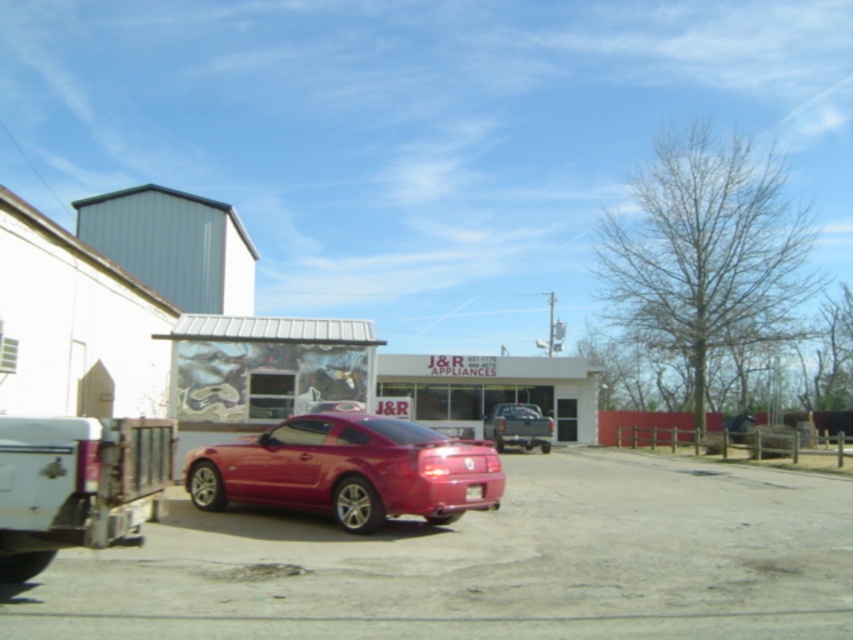
You are a delivery person needing to park your vehicle in the parking spot behind the glossy red car at center and the white matte truck at lower left. Which vehicle should you park behind to ensure you have enough space for your delivery van, which is 6 meters long?

The white matte truck at lower left is larger than the glossy red car at center, so you should park behind the white matte truck at lower left to have enough space for your 6 meters long delivery van.

You are standing at the point with coordinates point [15,554] and want to walk to the point with coordinates point [544,436]. Which direction should you move?

You should move backward because point [15,554] is in front of point [544,436].